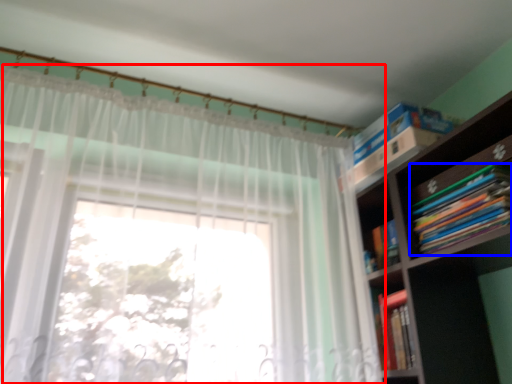
Question: Which object is further to the camera taking this photo, curtain (highlighted by a red box) or book (highlighted by a blue box)?

Choices:
 (A) curtain
 (B) book

Answer: (B)